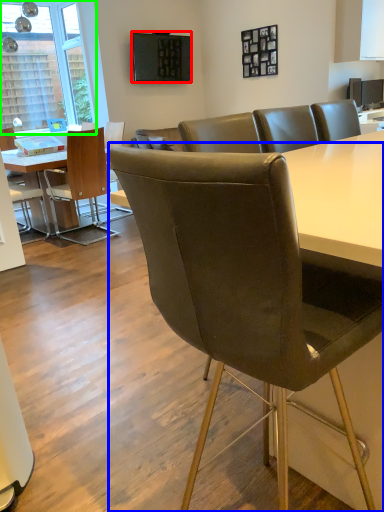
Question: Considering the real-world distances, which object is closest to television (highlighted by a red box)? chair (highlighted by a blue box) or window (highlighted by a green box).

Choices:
 (A) chair
 (B) window

Answer: (B)